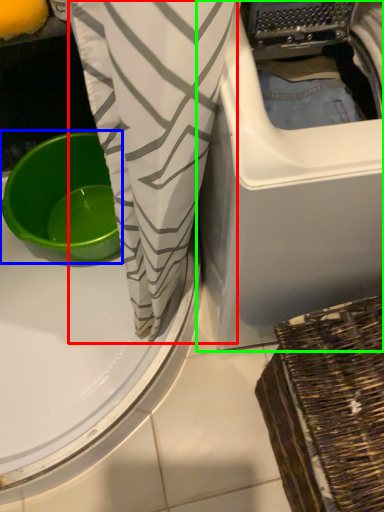
Question: Considering the real-world distances, which object is farthest from clothing (highlighted by a red box)? basin (highlighted by a blue box) or washing machine (highlighted by a green box)?

Choices:
 (A) basin
 (B) washing machine

Answer: (A)